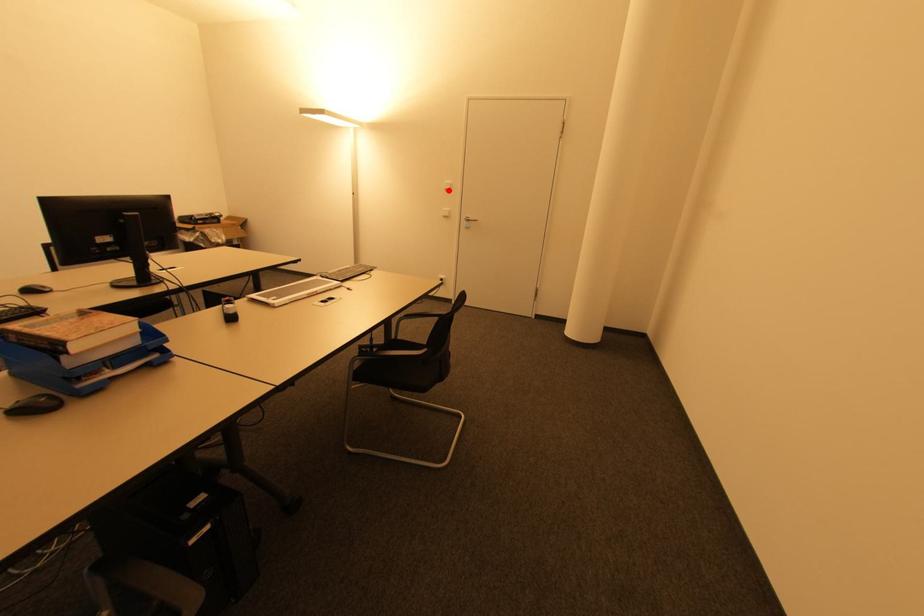
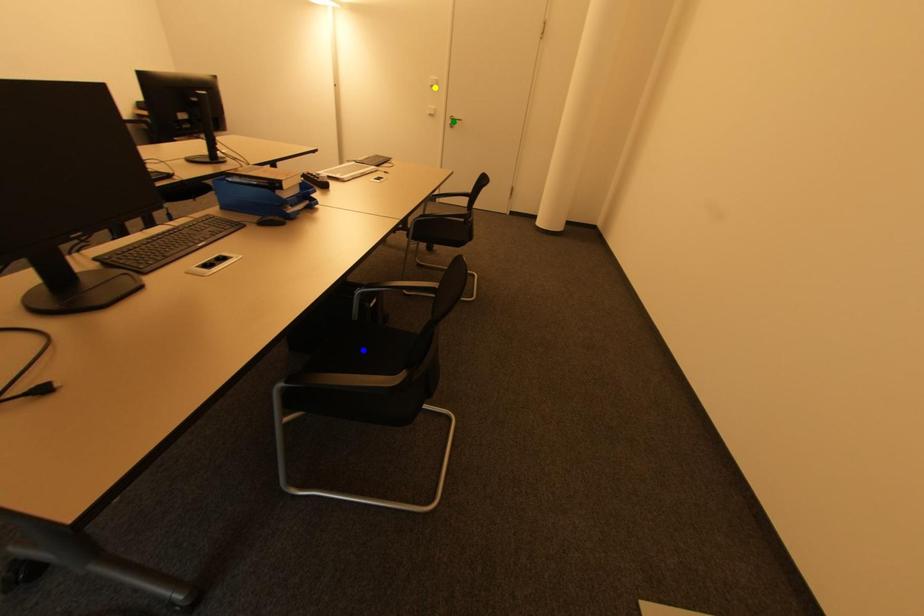
Question: I am providing you with two images of the same scene from different viewpoints. A red point is marked on the first image. You are given multiple points on the second image. Which point in image 2 is actually the same real-world point as the red point in image 1?

Choices:
 (A) blue point
 (B) yellow point
 (C) green point

Answer: (B)